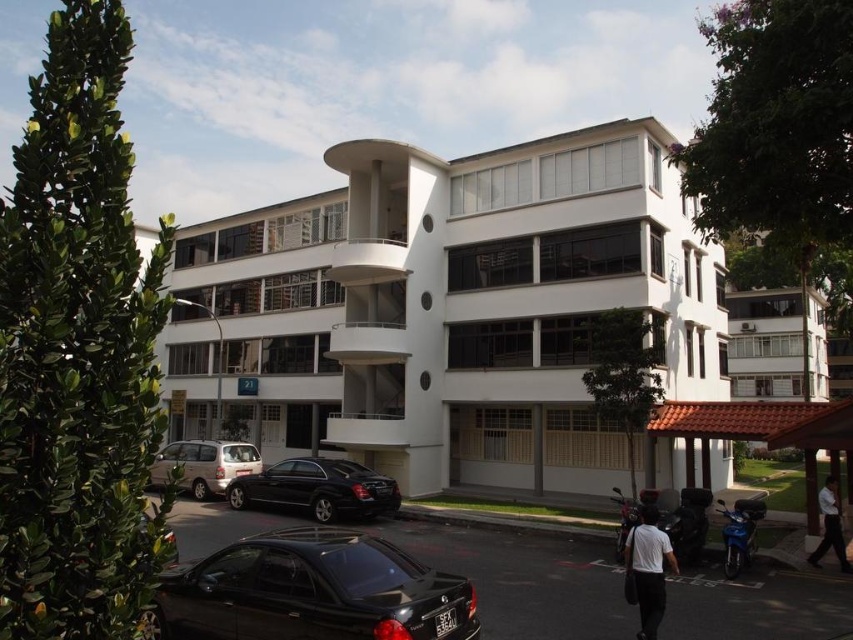
You are a delivery person trying to park your 1.8 meters tall delivery cart between the shiny black sedan at center and the white matte shirt at lower right. Can your cart fit vertically between them?

The shiny black sedan at center is not as tall as white matte shirt at lower right. Since the delivery cart is 1.8 meters tall, it depends on the minimum height between them. However, since the sedan is shorter than the shirt, the space might be sufficient if the shirt isn

You are standing on the sidewalk in front of the building and see the shiny black sedan at center and the white matte shirt at lower right. Which object is closer to the left side of the sidewalk?

The shiny black sedan at center is positioned on the left side of white matte shirt at lower right, so it is closer to the left side of the sidewalk.